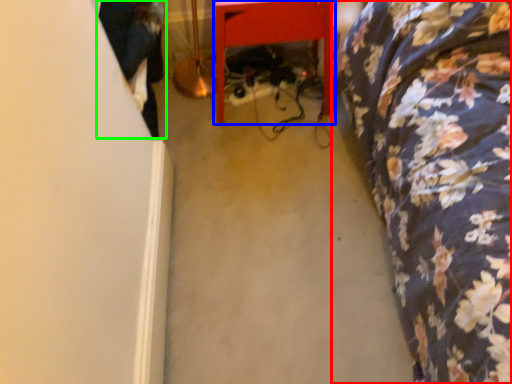
Question: Which object is positioned farthest from furniture (highlighted by a red box)? Select from furniture (highlighted by a blue box) and couple (highlighted by a green box).

Choices:
 (A) furniture
 (B) couple

Answer: (B)